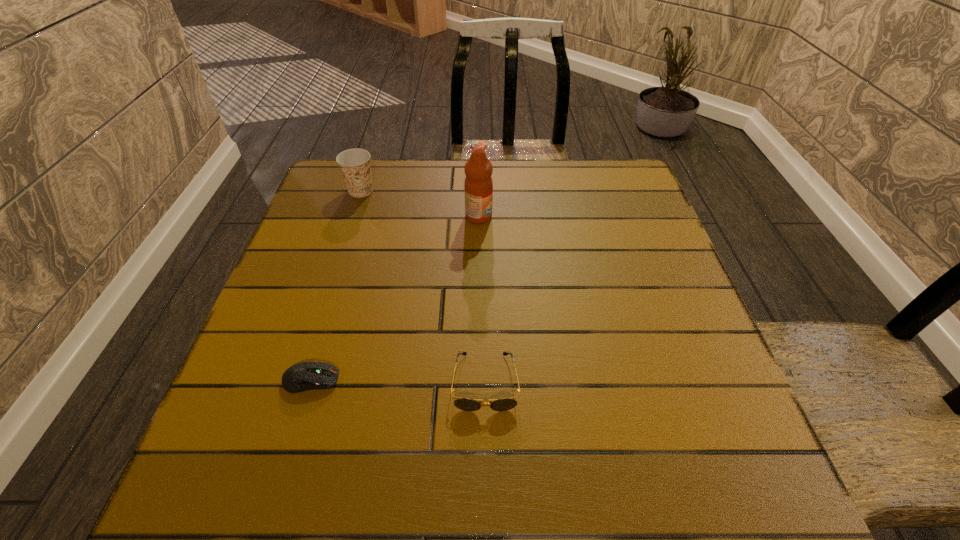
Where is `object that is the second closest to the second shortest object`? The width and height of the screenshot is (960, 540). object that is the second closest to the second shortest object is located at coordinates (478, 185).

Point out which object is positioned as the third nearest to the tallest object. Please provide its 2D coordinates. Your answer should be formatted as a tuple, i.e. [(x, y)], where the tuple contains the x and y coordinates of a point satisfying the conditions above.

[(303, 376)]